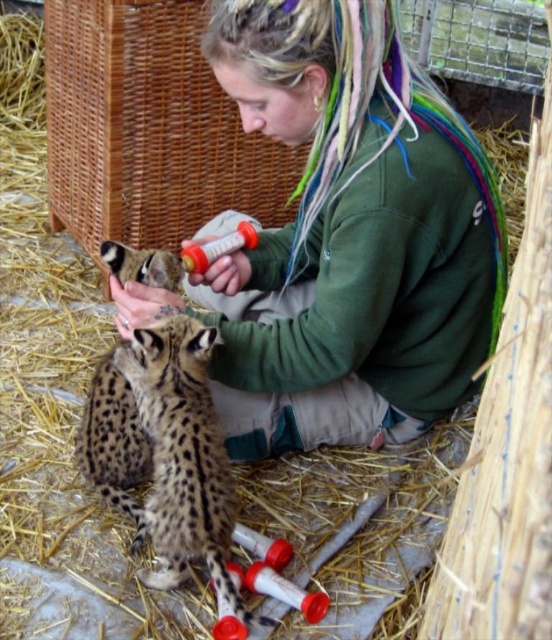
You are a visitor at a wildlife sanctuary and see the green fleece jacket at center and the spotted fur cheetah at center. Which object is nearer to you?

The green fleece jacket at center is closer to the viewer than the spotted fur cheetah at center.

You are a photographer standing 1.5 meters away from the camera position. You want to take a closeup photo of the green fleece jacket at center. Can you reach it without moving your position?

The green fleece jacket at center is 1.14 meters away from the camera. Since you are standing 1.5 meters away from the camera position, you are farther than the jacket. To take a closeup, you need to move closer to reduce the distance between yourself and the jacket.

You are a zookeeper who needs to decide which item to grab first for a quick task. The green fleece jacket at center and the spotted fur cheetah at center are both in your line of sight. Which object is wider?

The green fleece jacket at center might be wider than the spotted fur cheetah at center, so the green fleece jacket at center is likely the wider object.